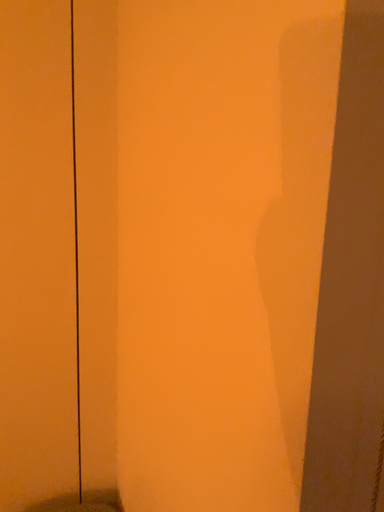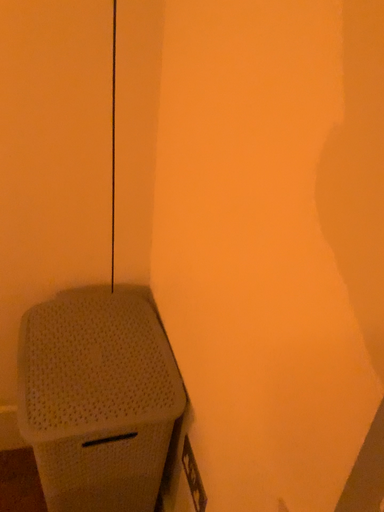
Question: Which way did the camera rotate in the video?

Choices:
 (A) rotated upward
 (B) rotated downward

Answer: (B)